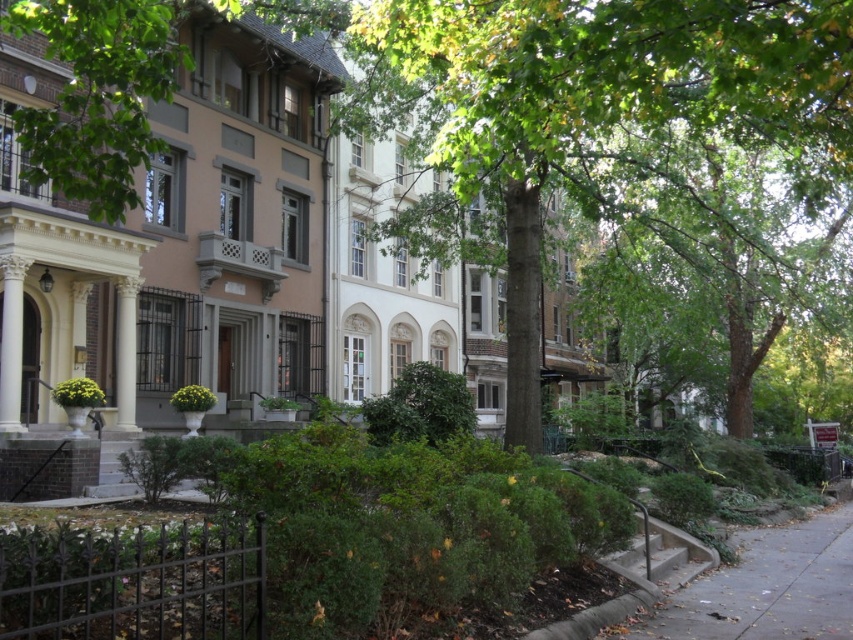
Who is positioned more to the right, green leafy tree at center or gray concrete sidewalk at lower right?

gray concrete sidewalk at lower right is more to the right.

Does green leafy tree at center lie in front of gray concrete sidewalk at lower right?

Yes, green leafy tree at center is closer to the viewer.

Between point (645, 36) and point (815, 588), which one is positioned behind?

Positioned behind is point (815, 588).

Identify the location of green leafy tree at center. The image size is (853, 640). pyautogui.click(x=578, y=109).